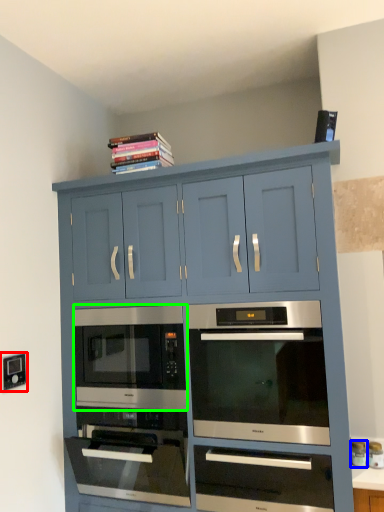
Question: Based on their relative distances, which object is farther from electric outlet (highlighted by a red box)? Choose from appliance (highlighted by a blue box) and microwave oven (highlighted by a green box).

Choices:
 (A) appliance
 (B) microwave oven

Answer: (A)